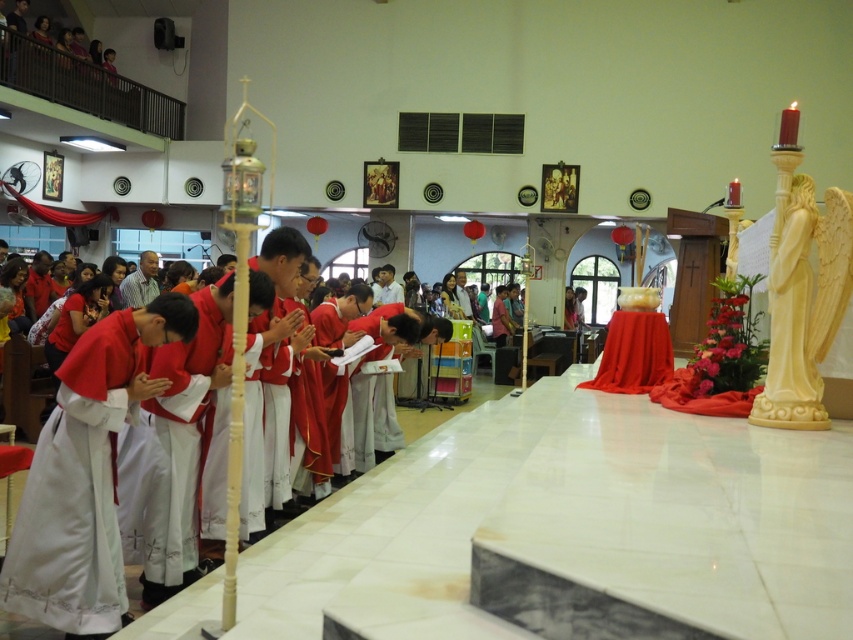
Is point (108, 404) farther from viewer compared to point (27, 621)?

No, it is not.

Is white satin robe at lower left shorter than matte red robe at center?

Correct, white satin robe at lower left is not as tall as matte red robe at center.

The image size is (853, 640). Identify the location of white satin robe at lower left. (76, 493).